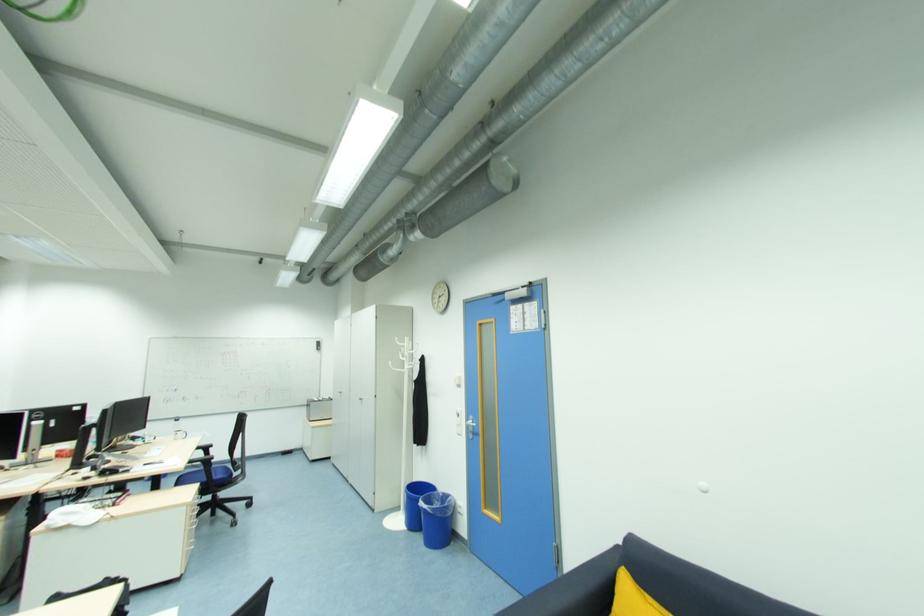
Where would you sit the blue chair seat? Please return your answer as a coordinate pair (x, y).

(205, 476)